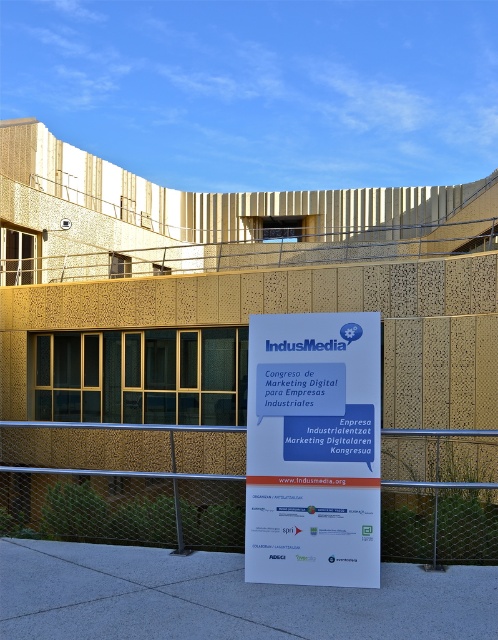
Question: Is wire mesh fence at center above white paper sign at center?

Choices:
 (A) no
 (B) yes

Answer: (A)

Question: Which object appears closest to the camera in this image?

Choices:
 (A) white paper sign at center
 (B) wire mesh fence at center

Answer: (A)

Question: Which of the following is the closest to the observer?

Choices:
 (A) (299, 532)
 (B) (431, 556)

Answer: (A)

Question: Is wire mesh fence at center to the right of white paper sign at center from the viewer's perspective?

Choices:
 (A) no
 (B) yes

Answer: (A)

Question: Does wire mesh fence at center have a smaller size compared to white paper sign at center?

Choices:
 (A) no
 (B) yes

Answer: (A)